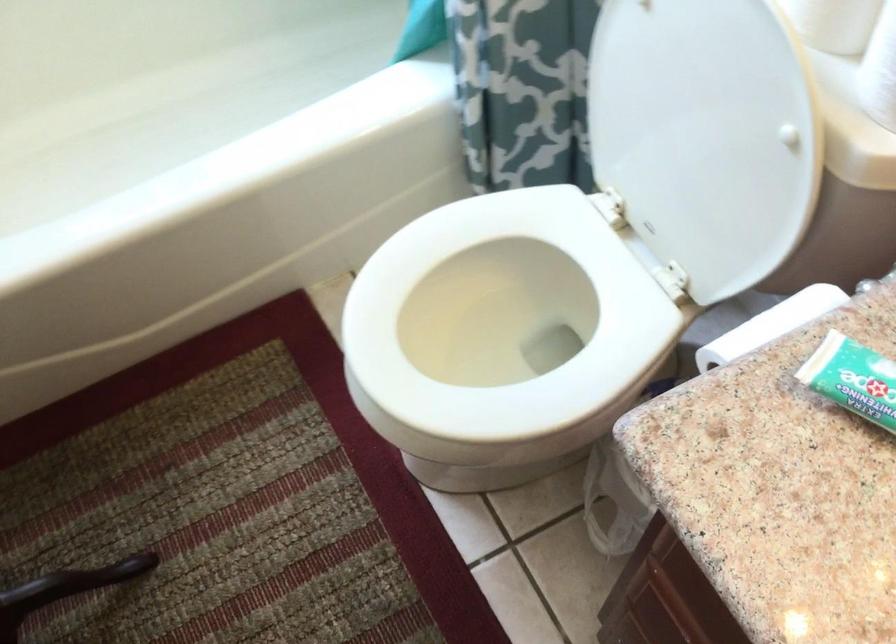
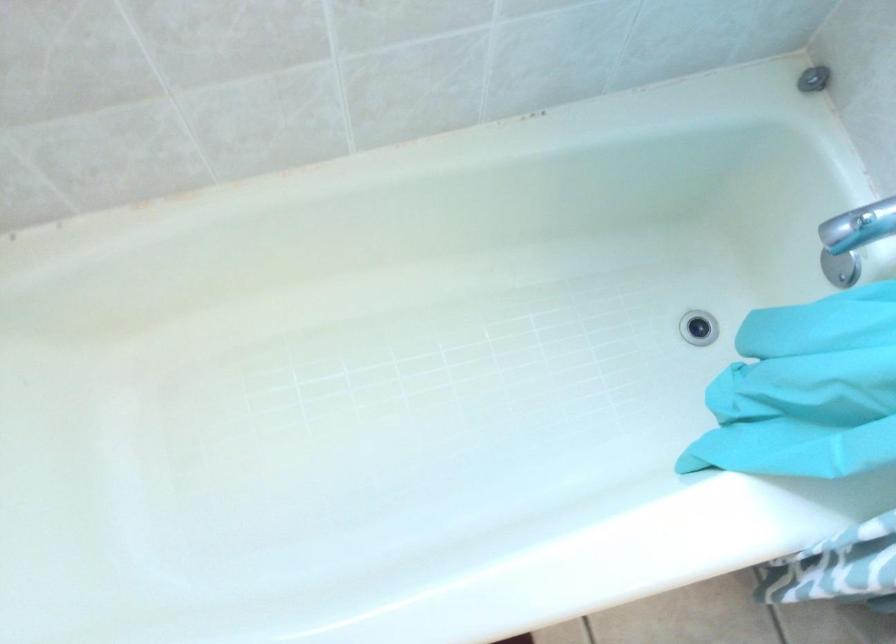
Question: The images are taken continuously from a first-person perspective. In which direction is your viewpoint rotating?

Choices:
 (A) Left
 (B) Right
 (C) Up
 (D) Down

Answer: (D)